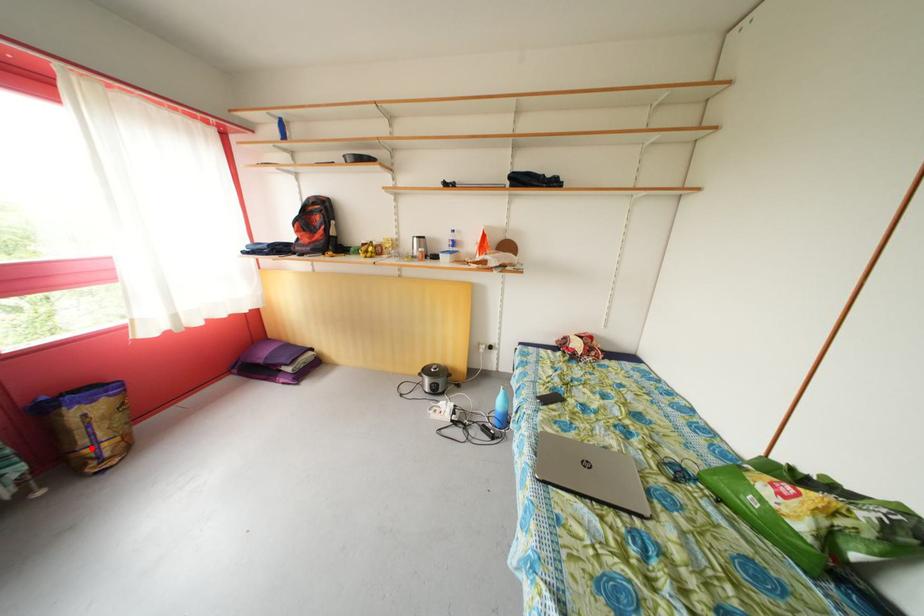
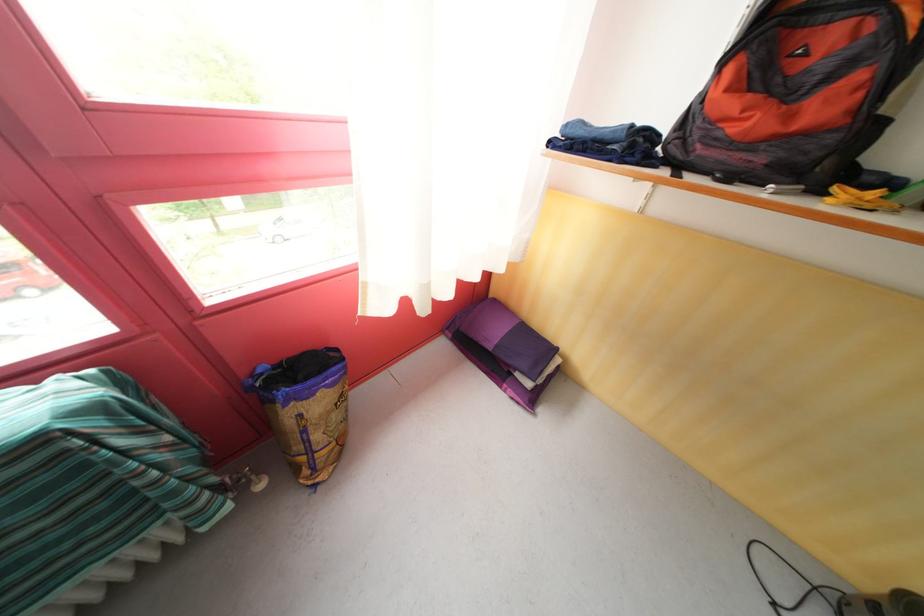
Find the pixel in the second image that matches the highlighted location in the first image.

(305, 454)